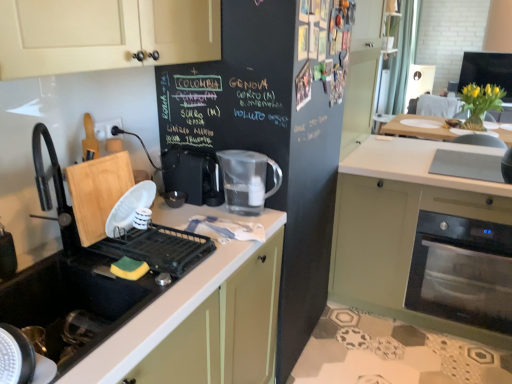
Question: Does black rubber sink at lower left have a lesser height compared to green matte oven at lower right?

Choices:
 (A) no
 (B) yes

Answer: (B)

Question: Is black rubber sink at lower left bigger than green matte oven at lower right?

Choices:
 (A) no
 (B) yes

Answer: (A)

Question: Can you see black rubber sink at lower left touching green matte oven at lower right?

Choices:
 (A) no
 (B) yes

Answer: (A)

Question: Is black rubber sink at lower left not close to green matte oven at lower right?

Choices:
 (A) no
 (B) yes

Answer: (B)

Question: From the image's perspective, is black rubber sink at lower left located above green matte oven at lower right?

Choices:
 (A) no
 (B) yes

Answer: (A)

Question: Is transparent plastic pitcher at center to the left or to the right of black plastic coffee machine at center in the image?

Choices:
 (A) left
 (B) right

Answer: (B)

Question: In the image, is transparent plastic pitcher at center positioned in front of or behind black plastic coffee machine at center?

Choices:
 (A) front
 (B) behind

Answer: (A)

Question: Considering the positions of transparent plastic pitcher at center and black plastic coffee machine at center in the image, is transparent plastic pitcher at center bigger or smaller than black plastic coffee machine at center?

Choices:
 (A) big
 (B) small

Answer: (A)

Question: Considering the positions of point (256, 152) and point (184, 152), is point (256, 152) closer or farther from the camera than point (184, 152)?

Choices:
 (A) farther
 (B) closer

Answer: (B)

Question: Is point (450, 195) positioned closer to the camera than point (209, 157)?

Choices:
 (A) closer
 (B) farther

Answer: (B)

Question: Looking at the image, does green matte oven at lower right seem bigger or smaller compared to black plastic coffee machine at center?

Choices:
 (A) big
 (B) small

Answer: (A)

Question: From a real-world perspective, is green matte oven at lower right above or below black plastic coffee machine at center?

Choices:
 (A) below
 (B) above

Answer: (A)

Question: Considering the positions of green matte oven at lower right and black plastic coffee machine at center in the image, is green matte oven at lower right taller or shorter than black plastic coffee machine at center?

Choices:
 (A) short
 (B) tall

Answer: (B)

Question: Looking at the image, does black rubber sink at lower left seem bigger or smaller compared to green matte oven at lower right?

Choices:
 (A) small
 (B) big

Answer: (A)

Question: Considering the positions of black rubber sink at lower left and green matte oven at lower right in the image, is black rubber sink at lower left wider or thinner than green matte oven at lower right?

Choices:
 (A) wide
 (B) thin

Answer: (B)